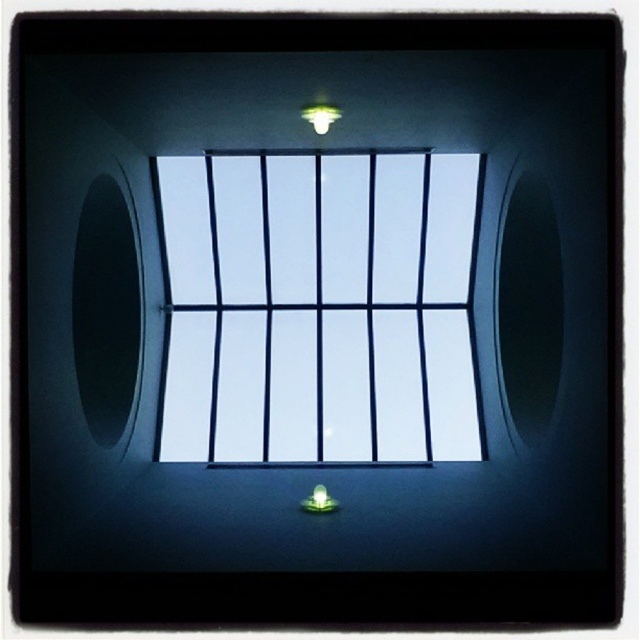
Which is behind, point (429, 358) or point (314, 125)?

The point (429, 358) is more distant.

Who is more forward, (321, 272) or (326, 129)?

Point (326, 129) is more forward.

Is point (397, 205) less distant than point (316, 116)?

No, it is behind (316, 116).

Image resolution: width=640 pixels, height=640 pixels. Identify the location of transparent glass window at center. (320, 307).